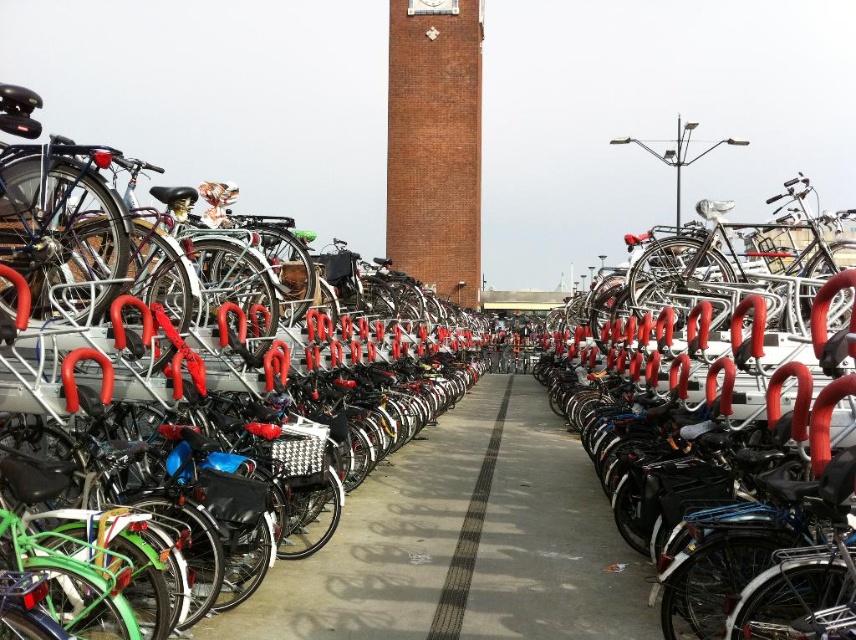
You are standing in the bicycle parking area and want to walk towards the point marked at coordinates (708, 529). How far will you have to walk to reach that point?

The point at coordinates (708, 529) is 29.42 meters away from your current position, so you will have to walk 29.42 meters to reach it.

Looking at this image, you are a delivery person who needs to park your bicycle in this area. You notice the shiny black bicycle at right and the black rubber line at center. Which object takes up more space in the parking area?

The shiny black bicycle at right is bigger than the black rubber line at center, so it takes up more space in the parking area.